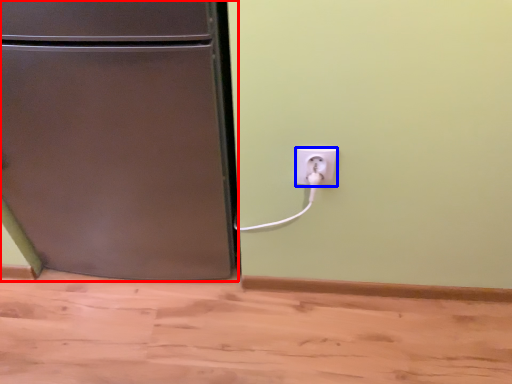
Question: Which of the following is the closest to the observer, refrigerator (highlighted by a red box) or power plugs and sockets (highlighted by a blue box)?

Choices:
 (A) refrigerator
 (B) power plugs and sockets

Answer: (A)